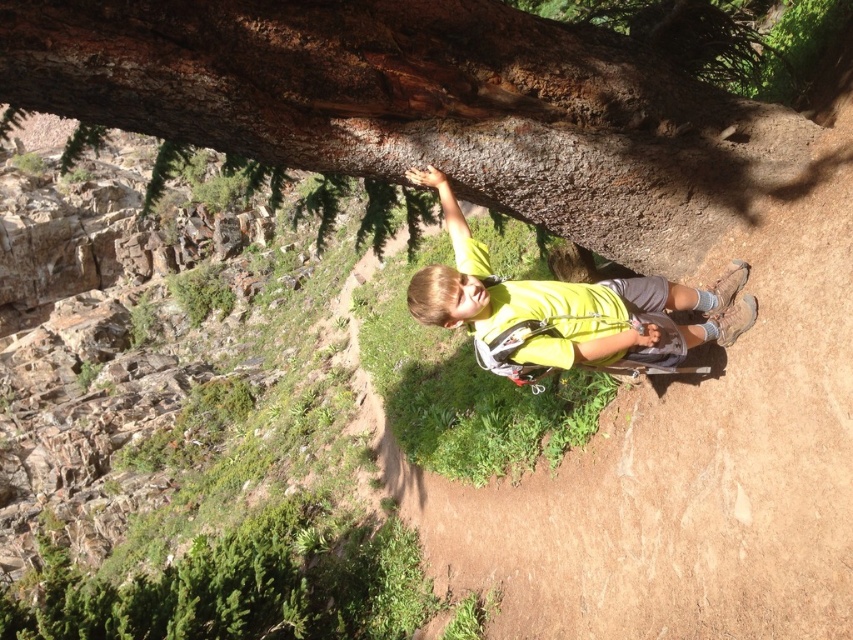
Who is positioned more to the right, smooth brown bark at upper center or yellow fabric shirt at center?

Positioned to the right is yellow fabric shirt at center.

How distant is smooth brown bark at upper center from yellow fabric shirt at center?

A distance of 29.24 inches exists between smooth brown bark at upper center and yellow fabric shirt at center.

Which is in front, point (633, 205) or point (683, 333)?

Positioned in front is point (683, 333).

This screenshot has height=640, width=853. Identify the location of smooth brown bark at upper center. (422, 106).